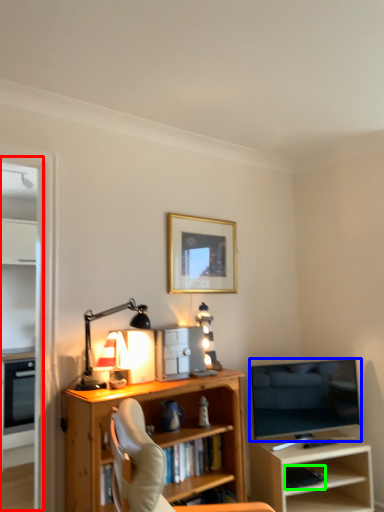
Question: Considering the real-world distances, which object is farthest from glass door (highlighted by a red box)? television (highlighted by a blue box) or book (highlighted by a green box)?

Choices:
 (A) television
 (B) book

Answer: (B)